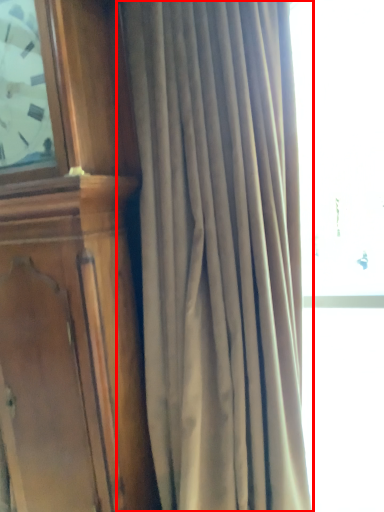
Question: Where is curtain (annotated by the red box) located in relation to furniture in the image?

Choices:
 (A) right
 (B) left

Answer: (A)